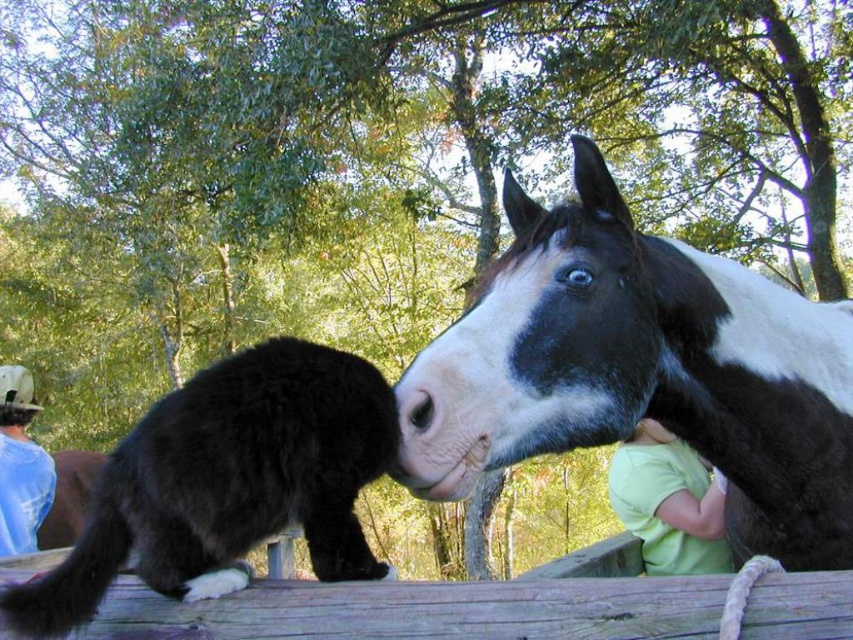
Question: Which of the following is the closest to the observer?

Choices:
 (A) light green fabric at lower right
 (B) blue denim shirt at upper left
 (C) fluffy black cat at left

Answer: (C)

Question: Is fluffy black cat at left thinner than light green fabric at lower right?

Choices:
 (A) no
 (B) yes

Answer: (A)

Question: Which point is farther to the camera?

Choices:
 (A) black and white speckled horse at right
 (B) light green fabric at lower right

Answer: (B)

Question: Is black and white speckled horse at right in front of blue denim shirt at upper left?

Choices:
 (A) yes
 (B) no

Answer: (A)

Question: Which is farther from the light green fabric at lower right?

Choices:
 (A) fluffy black cat at left
 (B) blue denim shirt at upper left
 (C) black and white speckled horse at right

Answer: (B)

Question: Can you confirm if black and white speckled horse at right is positioned below fluffy black cat at left?

Choices:
 (A) yes
 (B) no

Answer: (B)